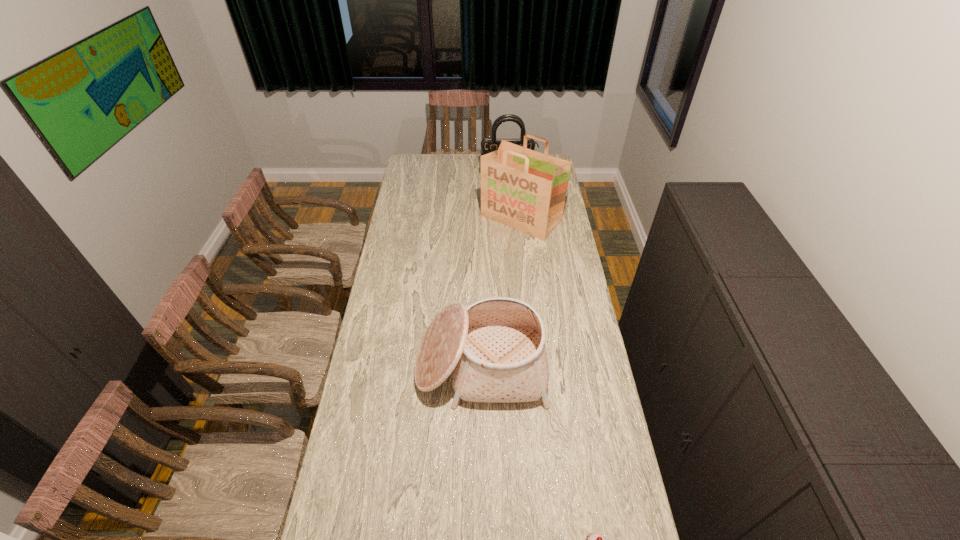
Where is `the third nearest object`? Image resolution: width=960 pixels, height=540 pixels. the third nearest object is located at coordinates click(x=524, y=189).

Identify the location of the tallest object. Image resolution: width=960 pixels, height=540 pixels. (524, 189).

Locate an element on the screen. The image size is (960, 540). handbag is located at coordinates (488, 145).

The width and height of the screenshot is (960, 540). What are the coordinates of `the farthest object` in the screenshot? It's located at point(488,145).

You are a GUI agent. You are given a task and a screenshot of the screen. Output one action in this format:
    pyautogui.click(x=<x>, y=<y>)
    Task: Click on the third farthest object
    The height and width of the screenshot is (540, 960).
    Given the screenshot: What is the action you would take?
    pyautogui.click(x=495, y=349)

You are a GUI agent. You are given a task and a screenshot of the screen. Output one action in this format:
    pyautogui.click(x=<x>, y=<y>)
    Task: Click on the basket
    The width and height of the screenshot is (960, 540).
    Given the screenshot: What is the action you would take?
    pyautogui.click(x=495, y=349)

Identify the location of free spot located 0.090m on the front of the third nearest object. tap(525, 253).

In order to click on vacant space located 0.330m with an open clasp on the front of the farthest object in this screenshot , I will do point(511,208).

Image resolution: width=960 pixels, height=540 pixels. Find the location of `vacant space situated 0.240m with the lid open on the third tallest object`. vacant space situated 0.240m with the lid open on the third tallest object is located at coordinates (480, 482).

The height and width of the screenshot is (540, 960). I want to click on object that is at the far edge, so click(488, 145).